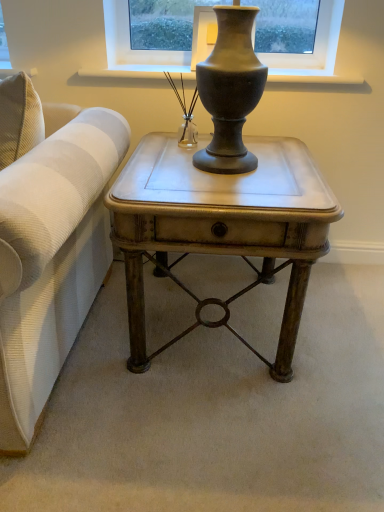
Question: Can you see matte gray vase at upper center touching matte metallic side table at center?

Choices:
 (A) no
 (B) yes

Answer: (A)

Question: Is matte gray vase at upper center positioned beyond the bounds of matte metallic side table at center?

Choices:
 (A) no
 (B) yes

Answer: (B)

Question: From a real-world perspective, does matte gray vase at upper center stand above matte metallic side table at center?

Choices:
 (A) yes
 (B) no

Answer: (A)

Question: From a real-world perspective, is matte gray vase at upper center positioned under matte metallic side table at center based on gravity?

Choices:
 (A) no
 (B) yes

Answer: (A)

Question: From the image's perspective, is matte gray vase at upper center on matte metallic side table at center?

Choices:
 (A) no
 (B) yes

Answer: (B)

Question: Can you confirm if matte gray vase at upper center is bigger than matte metallic side table at center?

Choices:
 (A) no
 (B) yes

Answer: (A)

Question: Is clear glass vase at center turned away from matte gray vase at upper center?

Choices:
 (A) no
 (B) yes

Answer: (B)

Question: Is clear glass vase at center taller than matte gray vase at upper center?

Choices:
 (A) no
 (B) yes

Answer: (B)

Question: Considering the relative sizes of clear glass vase at center and matte gray vase at upper center in the image provided, is clear glass vase at center bigger than matte gray vase at upper center?

Choices:
 (A) yes
 (B) no

Answer: (B)

Question: Is clear glass vase at center placed right next to matte gray vase at upper center?

Choices:
 (A) yes
 (B) no

Answer: (B)

Question: Can you confirm if clear glass vase at center is shorter than matte gray vase at upper center?

Choices:
 (A) no
 (B) yes

Answer: (A)

Question: From the image's perspective, does clear glass vase at center appear higher than matte gray vase at upper center?

Choices:
 (A) no
 (B) yes

Answer: (A)

Question: Are matte metallic side table at center and matte gray vase at upper center beside each other?

Choices:
 (A) yes
 (B) no

Answer: (B)